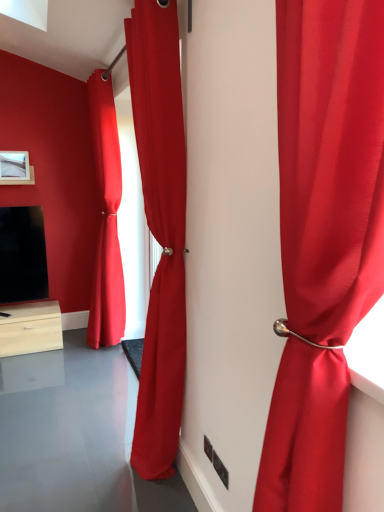
Find the location of a particular element. Image resolution: width=384 pixels, height=512 pixels. vacant space situated on the left part of satin red curtain at center, the 2th curtain positioned from the front is located at coordinates (85, 465).